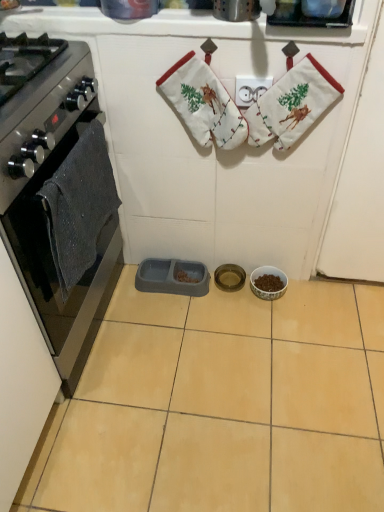
Question: Considering the relative positions of porcelain bowl at center, the third appliance in the left-to-right sequence, and beige ceramic tile at center in the image provided, is porcelain bowl at center, the third appliance in the left-to-right sequence, to the right of beige ceramic tile at center from the viewer's perspective?

Choices:
 (A) no
 (B) yes

Answer: (B)

Question: Does porcelain bowl at center, which is the first appliance from right to left, come in front of beige ceramic tile at center?

Choices:
 (A) no
 (B) yes

Answer: (A)

Question: From the image's perspective, is porcelain bowl at center, which is the first appliance from right to left, on beige ceramic tile at center?

Choices:
 (A) no
 (B) yes

Answer: (B)

Question: Can you confirm if porcelain bowl at center, the third appliance in the left-to-right sequence, is thinner than beige ceramic tile at center?

Choices:
 (A) yes
 (B) no

Answer: (A)

Question: Is porcelain bowl at center, the third appliance in the left-to-right sequence, bigger than beige ceramic tile at center?

Choices:
 (A) yes
 (B) no

Answer: (B)

Question: Is porcelain bowl at center, which is the first appliance from right to left, far away from beige ceramic tile at center?

Choices:
 (A) no
 (B) yes

Answer: (A)

Question: Considering the relative positions of beige ceramic tile at center and white fabric stocking at upper center in the image provided, is beige ceramic tile at center to the right of white fabric stocking at upper center from the viewer's perspective?

Choices:
 (A) no
 (B) yes

Answer: (A)

Question: Is beige ceramic tile at center not within white fabric stocking at upper center?

Choices:
 (A) yes
 (B) no

Answer: (A)

Question: Does beige ceramic tile at center have a greater height compared to white fabric stocking at upper center?

Choices:
 (A) no
 (B) yes

Answer: (A)

Question: Does beige ceramic tile at center have a lesser height compared to white fabric stocking at upper center?

Choices:
 (A) yes
 (B) no

Answer: (A)

Question: Is beige ceramic tile at center bigger than white fabric stocking at upper center?

Choices:
 (A) yes
 (B) no

Answer: (A)

Question: Does beige ceramic tile at center have a lesser width compared to white fabric stocking at upper center?

Choices:
 (A) no
 (B) yes

Answer: (A)

Question: Considering the relative sizes of gray plastic pet feeder at center, which is the third appliance in right-to-left order, and white cotton hand towel at upper center, acting as the first hand towel starting from the right, in the image provided, is gray plastic pet feeder at center, which is the third appliance in right-to-left order, taller than white cotton hand towel at upper center, acting as the first hand towel starting from the right,?

Choices:
 (A) no
 (B) yes

Answer: (A)